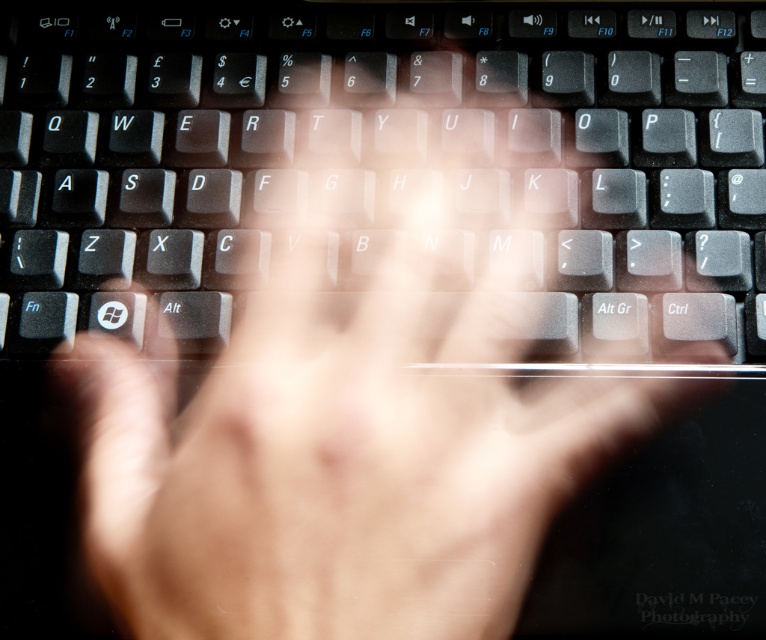
Does black matte keyboard at center have a larger size compared to translucent skin at center?

Correct, black matte keyboard at center is larger in size than translucent skin at center.

Consider the image. Between black matte keyboard at center and translucent skin at center, which one has less height?

black matte keyboard at center is shorter.

Does point (251, 19) lie behind point (257, 592)?

Yes, point (251, 19) is farther from viewer.

This screenshot has height=640, width=766. What are the coordinates of `black matte keyboard at center` in the screenshot? It's located at (378, 150).